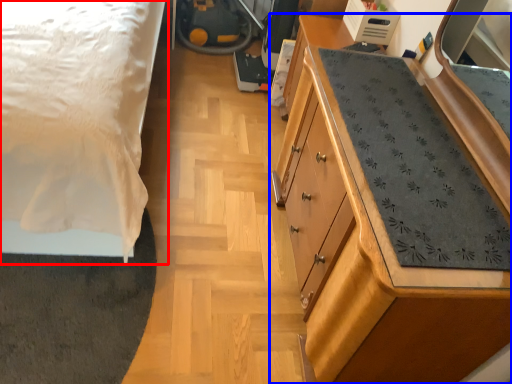
Question: Which point is further to the camera, bed (highlighted by a red box) or chest of drawers (highlighted by a blue box)?

Choices:
 (A) bed
 (B) chest of drawers

Answer: (B)